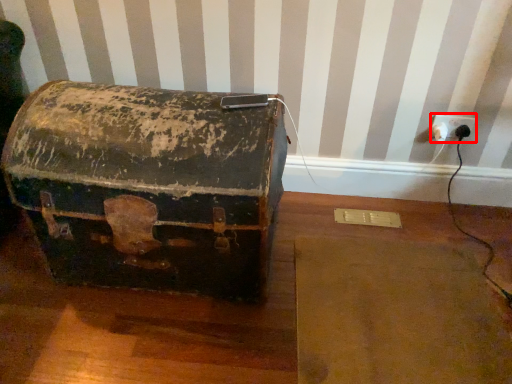
Question: From the image, what is the correct spatial relationship of electric outlet (annotated by the red box) in relation to box?

Choices:
 (A) left
 (B) right

Answer: (B)